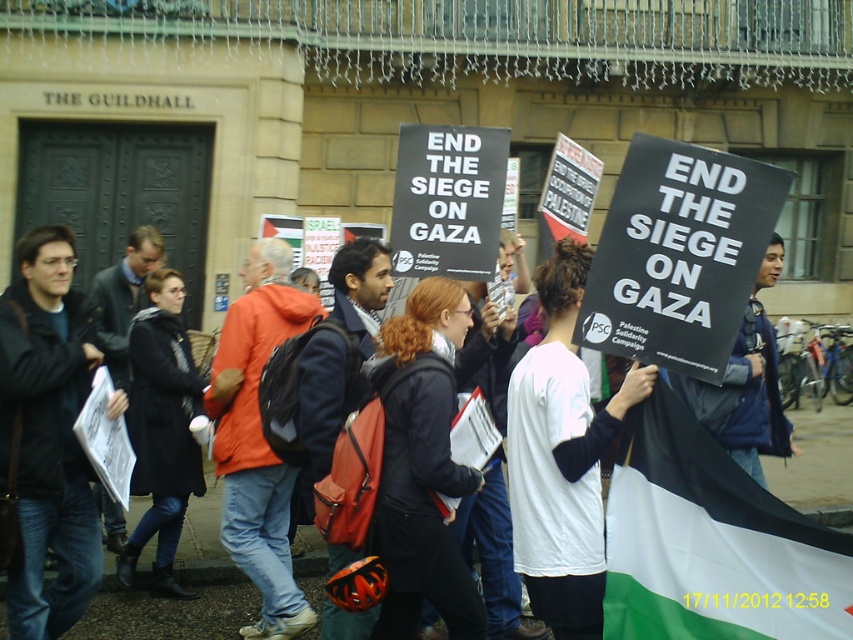
You are a photographer at the protest in front of THE GUILDHALL. You want to take a photo that includes both the point at coordinates point (53, 625) and point (746, 376). Based on their positions, which point should be closer to the camera?

Point (53, 625) is in front of point (746, 376), so it should be closer to the camera.

You are a photographer at the protest scene. You want to take a photo that includes both the white fabric flag at lower right and the blue denim jacket at center. Which object should you adjust your camera angle to focus on first to ensure both are in frame?

The white fabric flag at lower right has a lesser height compared to the blue denim jacket at center. To ensure both are in frame, you should focus on the taller blue denim jacket at center first, then adjust the angle to include the shorter white fabric flag at lower right.